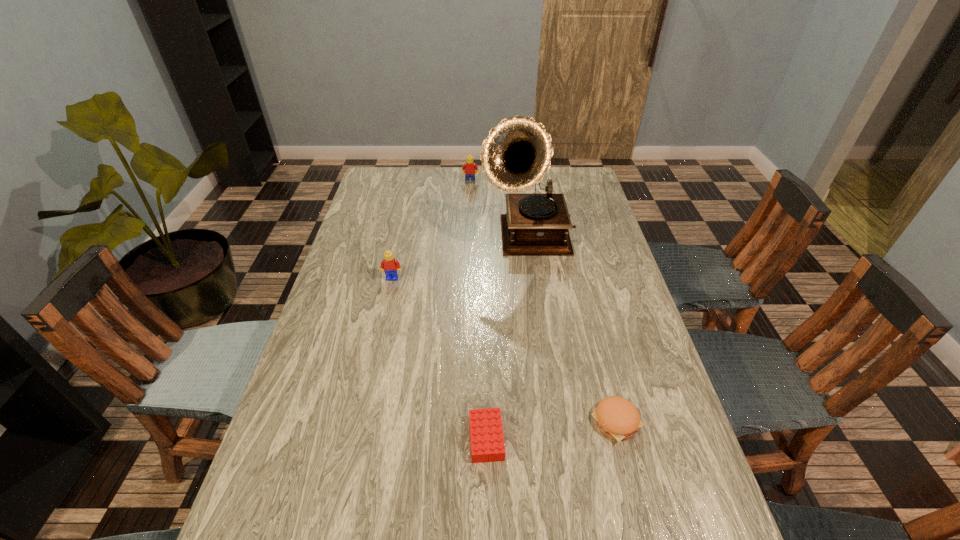
Where is `the tallest object`? This screenshot has height=540, width=960. the tallest object is located at coordinates (516, 154).

At what (x,y) coordinates should I click in order to perform the action: click on record player. Please return your answer as a coordinate pair (x, y). Looking at the image, I should click on pyautogui.click(x=516, y=154).

At what (x,y) coordinates should I click in order to perform the action: click on the farthest object. Please return your answer as a coordinate pair (x, y). Image resolution: width=960 pixels, height=540 pixels. Looking at the image, I should click on (470, 167).

Where is `the leftmost object`? This screenshot has width=960, height=540. the leftmost object is located at coordinates (389, 265).

The image size is (960, 540). What are the coordinates of `the third farthest object` in the screenshot? It's located at (389, 265).

You are a GUI agent. You are given a task and a screenshot of the screen. Output one action in this format:
    pyautogui.click(x=<x>, y=<y>)
    Task: Click on the patty
    This screenshot has height=540, width=960.
    Given the screenshot: What is the action you would take?
    pyautogui.click(x=616, y=417)

Locate an element on the screen. The width and height of the screenshot is (960, 540). the nearest Lego is located at coordinates (487, 442).

At what (x,y) coordinates should I click in order to perform the action: click on vacant space located on the horn of the record player. Please return your answer as a coordinate pair (x, y). Looking at the image, I should click on (533, 275).

This screenshot has height=540, width=960. In order to click on blank space located 0.310m on the front-facing side of the farthest Lego in this screenshot , I will do `click(468, 228)`.

Locate an element on the screen. vacant space situated on the front-facing side of the third farthest object is located at coordinates (372, 376).